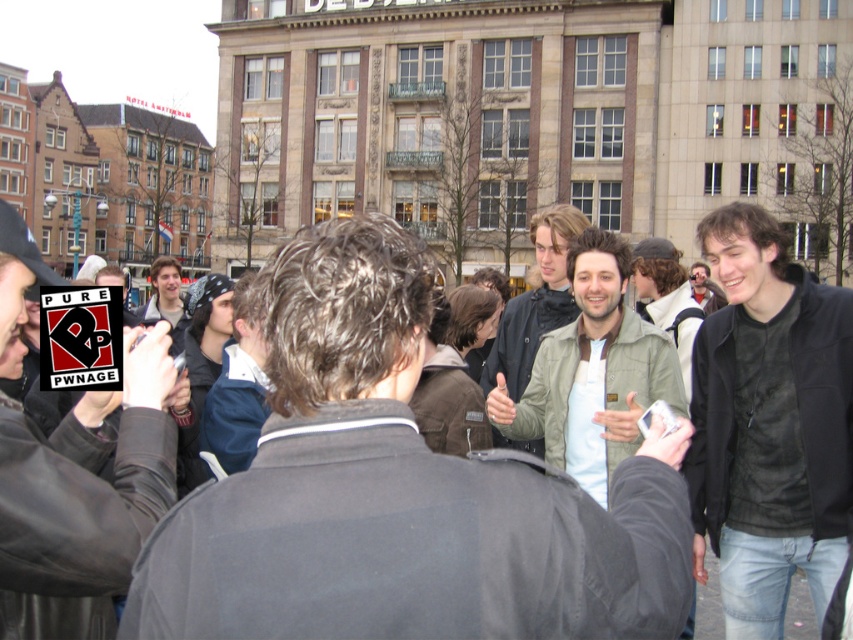
Based on the photo, you are standing in the city square and want to take a photo of both the point at coordinates (735, 460) and the point at coordinates (498, 404). Which point should you focus on first to ensure both are in clear view?

You should focus on point (735, 460) first because it is closer to the viewer than point (498, 404), ensuring both points are in clear view when adjusting the focus.